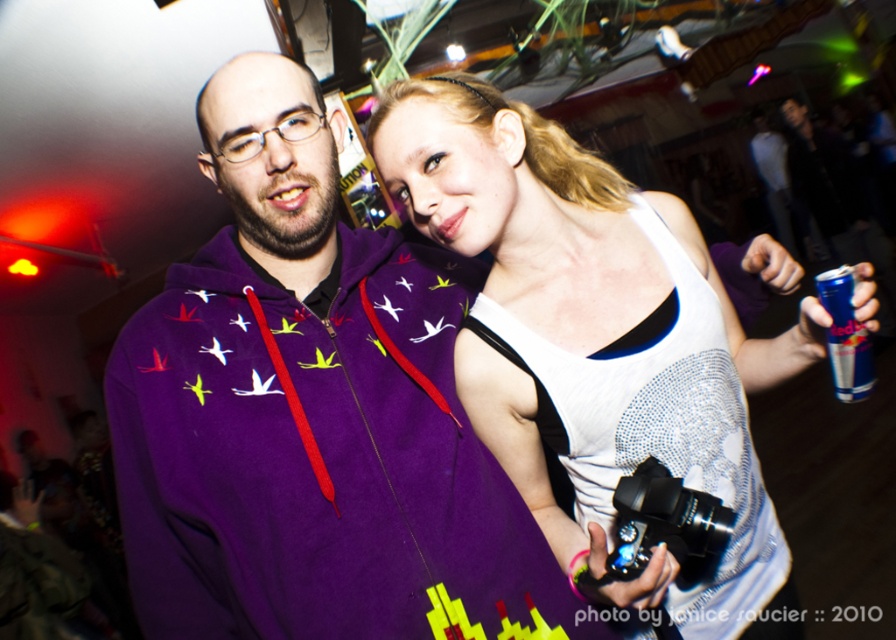
You are a photographer at a party and want to capture a candid shot of the two people standing near the purple fleece hoodie at center. The camera you are using has a maximum focus range of 30 inches. Will you be able to get both subjects in focus without moving closer?

The two subjects are 33.25 inches apart, which exceeds the camera maximum focus range of 30 inches. To get both in focus, you need to move closer so that the distance between them is within 30 inches.

You are organizing a photo shoot and need to ensure that the purple fleece hoodie at center and the black metallic camera at center are both visible in the frame. Given their sizes, which object should you prioritize positioning closer to the camera to maintain clarity and detail?

The purple fleece hoodie at center is wider than the black metallic camera at center. To maintain clarity and detail for both objects, prioritize positioning the wider purple fleece hoodie at center closer to the camera since larger objects may require more focus adjustment to ensure sharpness.